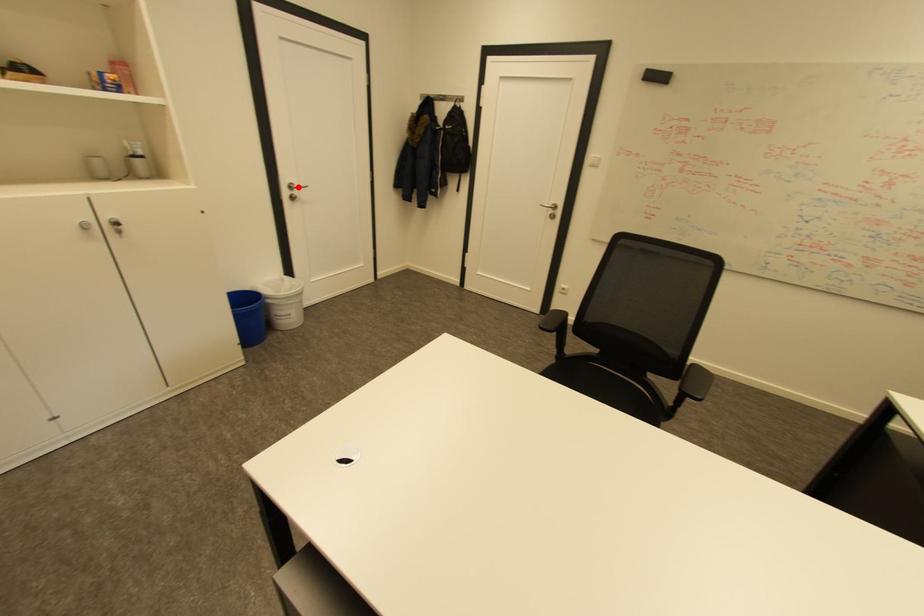
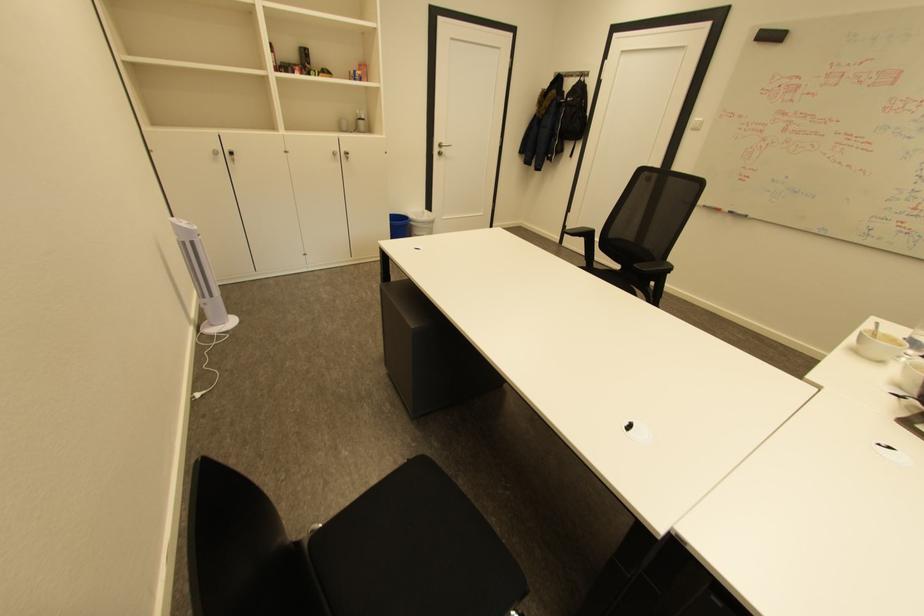
Locate, in the second image, the point that corresponds to the highlighted location in the first image.

(446, 146)